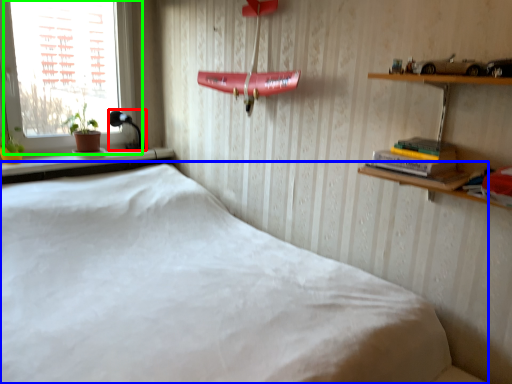
Question: Which is farther away from lamp (highlighted by a red box)? bed (highlighted by a blue box) or window (highlighted by a green box)?

Choices:
 (A) bed
 (B) window

Answer: (A)